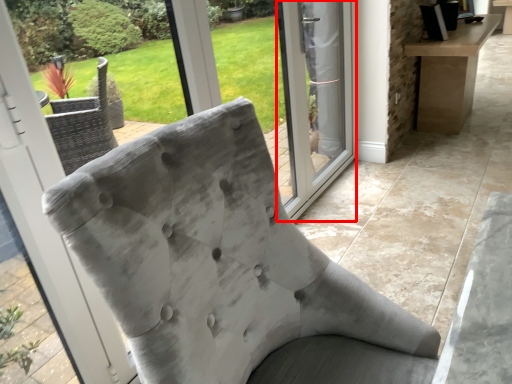
Question: Where is screen door (annotated by the red box) located in relation to chair in the image?

Choices:
 (A) right
 (B) left

Answer: (A)